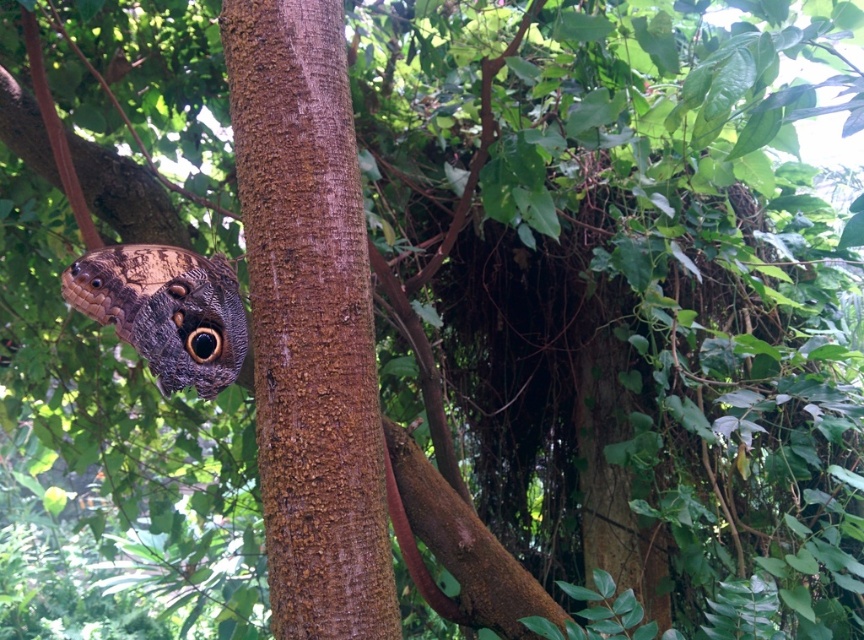
Question: Does brown rough bark at center appear on the left side of camouflage-patterned butterfly at center?

Choices:
 (A) yes
 (B) no

Answer: (B)

Question: Which point is closer to the camera?

Choices:
 (A) pos(98,257)
 (B) pos(264,305)

Answer: (B)

Question: Is brown rough bark at center smaller than camouflage-patterned butterfly at center?

Choices:
 (A) no
 (B) yes

Answer: (A)

Question: Is the position of brown rough bark at center less distant than that of camouflage-patterned butterfly at center?

Choices:
 (A) yes
 (B) no

Answer: (A)